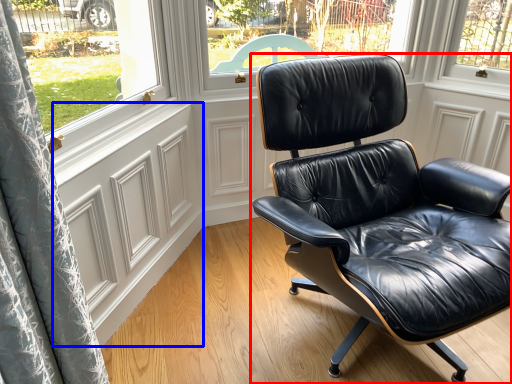
Question: Which point is further to the camera, chair (highlighted by a red box) or screen door (highlighted by a blue box)?

Choices:
 (A) chair
 (B) screen door

Answer: (B)